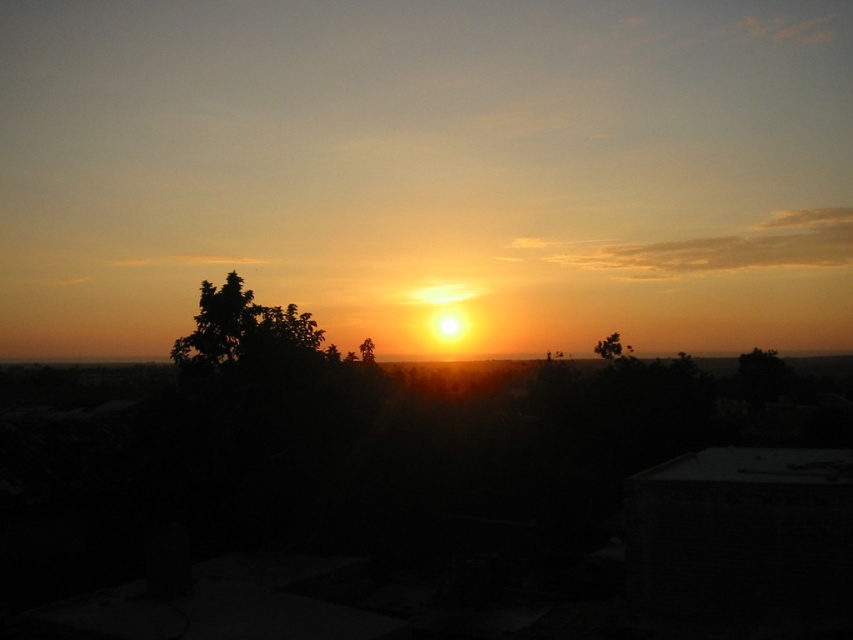
Describe the element at coordinates (611, 348) in the screenshot. I see `green leafy tree at upper right` at that location.

Can you confirm if green leafy tree at upper right is thinner than green leafy tree at center?

Yes, green leafy tree at upper right is thinner than green leafy tree at center.

Image resolution: width=853 pixels, height=640 pixels. Identify the location of green leafy tree at upper right. (611, 348).

This screenshot has width=853, height=640. I want to click on green leafy tree at upper right, so [x=611, y=348].